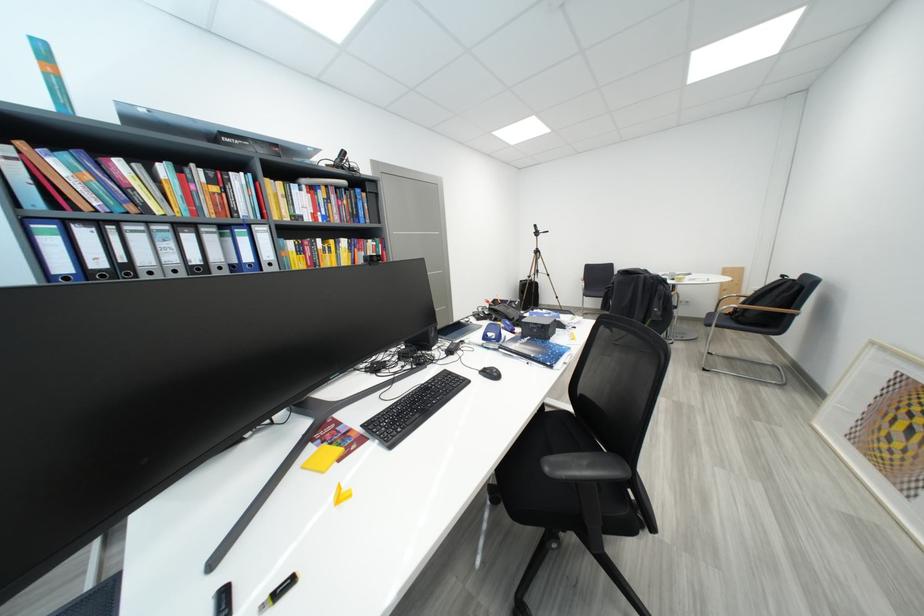
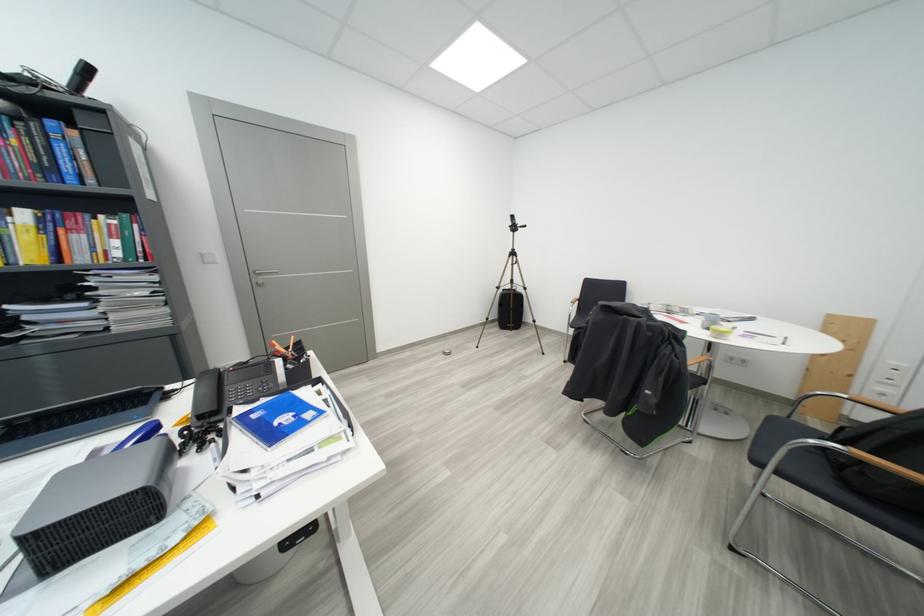
What movement of the cameraman would produce the second image?

The cameraman moved toward right, forward.